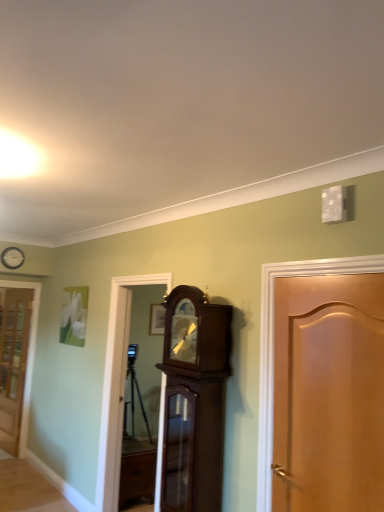
Locate an element on the screen. wooden door at right, the first door positioned from the front is located at coordinates (329, 394).

Measure the distance between point (137,481) and camera.

The depth of point (137,481) is 3.84 meters.

The height and width of the screenshot is (512, 384). What do you see at coordinates (13, 362) in the screenshot?
I see `translucent glass door at left, positioned as the 1th door in left-to-right order` at bounding box center [13, 362].

This screenshot has height=512, width=384. In order to click on white wooden clock at upper left in this screenshot , I will do `click(12, 258)`.

You are a GUI agent. You are given a task and a screenshot of the screen. Output one action in this format:
    pyautogui.click(x=<x>, y=<y>)
    Task: Click on the wooden door at right, the 1th door from the right
    
    Given the screenshot: What is the action you would take?
    pyautogui.click(x=329, y=394)

Considering the relative sizes of brown wooden cabinet at center, the 1th cabinetry from the left, and mahogany wood grandfather clock at center, which ranks as the second cabinetry in bottom-to-top order, in the image provided, is brown wooden cabinet at center, the 1th cabinetry from the left, bigger than mahogany wood grandfather clock at center, which ranks as the second cabinetry in bottom-to-top order,?

Actually, brown wooden cabinet at center, the 1th cabinetry from the left, might be smaller than mahogany wood grandfather clock at center, which ranks as the second cabinetry in bottom-to-top order.

Is the depth of brown wooden cabinet at center, the 1th cabinetry from the left, less than that of mahogany wood grandfather clock at center, which ranks as the second cabinetry in bottom-to-top order?

That is False.

Measure the distance from brown wooden cabinet at center, the 2th cabinetry when ordered from top to bottom, to mahogany wood grandfather clock at center, the first cabinetry from the front.

brown wooden cabinet at center, the 2th cabinetry when ordered from top to bottom, is 1.61 meters from mahogany wood grandfather clock at center, the first cabinetry from the front.

Is brown wooden cabinet at center, which ranks as the first cabinetry in back-to-front order, facing away from mahogany wood grandfather clock at center, the 2th cabinetry in the back-to-front sequence?

No, mahogany wood grandfather clock at center, the 2th cabinetry in the back-to-front sequence, is not at the back of brown wooden cabinet at center, which ranks as the first cabinetry in back-to-front order.

Could you tell me if brown wooden cabinet at center, acting as the 1th cabinetry starting from the bottom, is facing wooden door at right, the 1th door from the right?

No, brown wooden cabinet at center, acting as the 1th cabinetry starting from the bottom, is not turned towards wooden door at right, the 1th door from the right.

In the scene shown: Can you confirm if brown wooden cabinet at center, which ranks as the first cabinetry in back-to-front order, is positioned to the right of wooden door at right, which ranks as the second door in back-to-front order?

No.

From the image's perspective, is brown wooden cabinet at center, which ranks as the first cabinetry in back-to-front order, located above or below wooden door at right, the 2th door when ordered from left to right?

brown wooden cabinet at center, which ranks as the first cabinetry in back-to-front order, is below wooden door at right, the 2th door when ordered from left to right.

Can you tell me how much translucent glass door at left, which is the 2th door from front to back, and mahogany wood grandfather clock at center, the first cabinetry viewed from the right, differ in facing direction?

5.53 degrees.

Which object is positioned more to the left, translucent glass door at left, which is counted as the 1th door, starting from the back, or mahogany wood grandfather clock at center, the first cabinetry viewed from the right?

translucent glass door at left, which is counted as the 1th door, starting from the back.

In terms of height, does translucent glass door at left, which is the second door from right to left, look taller or shorter compared to mahogany wood grandfather clock at center, the first cabinetry viewed from the right?

Considering their sizes, translucent glass door at left, which is the second door from right to left, has more height than mahogany wood grandfather clock at center, the first cabinetry viewed from the right.

From the image's perspective, is translucent glass door at left, positioned as the 1th door in left-to-right order, positioned above or below mahogany wood grandfather clock at center, the first cabinetry viewed from the right?

Based on their image positions, translucent glass door at left, positioned as the 1th door in left-to-right order, is located beneath mahogany wood grandfather clock at center, the first cabinetry viewed from the right.

Does white wooden clock at upper left have a lesser width compared to wooden door at right, which ranks as the second door in back-to-front order?

Indeed, white wooden clock at upper left has a lesser width compared to wooden door at right, which ranks as the second door in back-to-front order.

Who is bigger, white wooden clock at upper left or wooden door at right, which ranks as the second door in back-to-front order?

With larger size is wooden door at right, which ranks as the second door in back-to-front order.

From the image's perspective, which one is positioned lower, white wooden clock at upper left or wooden door at right, the 2th door when ordered from left to right?

From the image's view, wooden door at right, the 2th door when ordered from left to right, is below.

This screenshot has height=512, width=384. I want to click on clock on the left side of wooden door at right, the 1th door from the right, so click(x=12, y=258).

Based on the photo, is wooden door at right, the first door positioned from the front, oriented away from mahogany wood grandfather clock at center, the 2th cabinetry viewed from the left?

No, wooden door at right, the first door positioned from the front, is not facing away from mahogany wood grandfather clock at center, the 2th cabinetry viewed from the left.

The image size is (384, 512). Identify the location of door located above the mahogany wood grandfather clock at center, the first cabinetry from the front (from a real-world perspective). coord(329,394).

Which is closer to the camera, (322, 313) or (172, 459)?

Point (322, 313) is closer to the camera than point (172, 459).

How much distance is there between wooden door at right, which ranks as the second door in back-to-front order, and mahogany wood grandfather clock at center, which ranks as the second cabinetry in bottom-to-top order?

wooden door at right, which ranks as the second door in back-to-front order, is 23.66 inches from mahogany wood grandfather clock at center, which ranks as the second cabinetry in bottom-to-top order.

Which is behind, point (13, 388) or point (371, 339)?

The point (13, 388) is more distant.

Can wooden door at right, the first door positioned from the front, be found inside translucent glass door at left, which is counted as the 1th door, starting from the back?

No, translucent glass door at left, which is counted as the 1th door, starting from the back, does not contain wooden door at right, the first door positioned from the front.

Is the surface of translucent glass door at left, positioned as the 1th door in left-to-right order, in direct contact with wooden door at right, the 1th door from the right?

translucent glass door at left, positioned as the 1th door in left-to-right order, and wooden door at right, the 1th door from the right, are not in contact.

Consider the image. From the image's perspective, which object appears higher, translucent glass door at left, positioned as the 1th door in left-to-right order, or wooden door at right, the 2th door when ordered from left to right?

From the image's view, wooden door at right, the 2th door when ordered from left to right, is above.

Is the position of wooden door at right, which ranks as the second door in back-to-front order, more distant than that of white wooden clock at upper left?

No, wooden door at right, which ranks as the second door in back-to-front order, is closer to the camera.

From a real-world perspective, who is located lower, wooden door at right, the first door positioned from the front, or white wooden clock at upper left?

wooden door at right, the first door positioned from the front, is physically lower.

Is wooden door at right, the first door positioned from the front, aimed at white wooden clock at upper left?

No, wooden door at right, the first door positioned from the front, is not oriented towards white wooden clock at upper left.

From the picture: Is wooden door at right, the 2th door when ordered from left to right, shorter than white wooden clock at upper left?

In fact, wooden door at right, the 2th door when ordered from left to right, may be taller than white wooden clock at upper left.

Where is `cabinetry in front of the brown wooden cabinet at center, acting as the 1th cabinetry starting from the bottom`? cabinetry in front of the brown wooden cabinet at center, acting as the 1th cabinetry starting from the bottom is located at coordinates (192, 443).

Where is `the 2nd cabinetry to the left when counting from the wooden door at right, the 1th door from the right`? the 2nd cabinetry to the left when counting from the wooden door at right, the 1th door from the right is located at coordinates (137, 470).

Estimate the real-world distances between objects in this image. Which object is further from mahogany wood grandfather clock at center, the 2th cabinetry in the back-to-front sequence, white wooden clock at upper left or translucent glass door at left, which is counted as the 1th door, starting from the back?

white wooden clock at upper left lies further to mahogany wood grandfather clock at center, the 2th cabinetry in the back-to-front sequence, than the other object.

Looking at this image, from the image, which object appears to be nearer to mahogany wood grandfather clock at center, the first cabinetry from the front, brown wooden cabinet at center, acting as the 1th cabinetry starting from the bottom, or white wooden clock at upper left?

brown wooden cabinet at center, acting as the 1th cabinetry starting from the bottom.

From the image, which object appears to be farther from mahogany wood grandfather clock at center, the 2th cabinetry in the back-to-front sequence, wooden door at right, the 2th door when ordered from left to right, or translucent glass door at left, positioned as the 1th door in left-to-right order?

translucent glass door at left, positioned as the 1th door in left-to-right order, is further to mahogany wood grandfather clock at center, the 2th cabinetry in the back-to-front sequence.

From the image, which object appears to be farther from brown wooden cabinet at center, placed as the second cabinetry when sorted from front to back, translucent glass door at left, positioned as the 1th door in left-to-right order, or wooden door at right, the 1th door from the right?

wooden door at right, the 1th door from the right, lies further to brown wooden cabinet at center, placed as the second cabinetry when sorted from front to back, than the other object.

Looking at the image, which one is located further to brown wooden cabinet at center, which appears as the 2th cabinetry when viewed from the right, translucent glass door at left, which is the 2th door from front to back, or mahogany wood grandfather clock at center, the first cabinetry viewed from the right?

translucent glass door at left, which is the 2th door from front to back, is further to brown wooden cabinet at center, which appears as the 2th cabinetry when viewed from the right.

Based on the photo, which object lies further to the anchor point white wooden clock at upper left, wooden door at right, which ranks as the second door in back-to-front order, or brown wooden cabinet at center, which ranks as the first cabinetry in back-to-front order?

Among the two, wooden door at right, which ranks as the second door in back-to-front order, is located further to white wooden clock at upper left.

When comparing their distances from brown wooden cabinet at center, the 1th cabinetry from the left, does mahogany wood grandfather clock at center, the 2th cabinetry in the back-to-front sequence, or wooden door at right, which ranks as the second door in back-to-front order, seem closer?

The object closer to brown wooden cabinet at center, the 1th cabinetry from the left, is mahogany wood grandfather clock at center, the 2th cabinetry in the back-to-front sequence.

Estimate the real-world distances between objects in this image. Which object is further from mahogany wood grandfather clock at center, the first cabinetry from the top, white wooden clock at upper left or brown wooden cabinet at center, the 2th cabinetry when ordered from top to bottom?

Among the two, white wooden clock at upper left is located further to mahogany wood grandfather clock at center, the first cabinetry from the top.

Locate an element on the screen. This screenshot has height=512, width=384. clock between mahogany wood grandfather clock at center, the first cabinetry from the front, and translucent glass door at left, positioned as the 1th door in left-to-right order, along the z-axis is located at coordinates (12, 258).

Locate an element on the screen. The width and height of the screenshot is (384, 512). cabinetry positioned between wooden door at right, the 1th door from the right, and brown wooden cabinet at center, which appears as the 2th cabinetry when viewed from the right, from near to far is located at coordinates (192, 443).

Identify the location of clock between wooden door at right, the 2th door when ordered from left to right, and translucent glass door at left, which is the second door from right to left, from front to back. The height and width of the screenshot is (512, 384). (12, 258).

You are a GUI agent. You are given a task and a screenshot of the screen. Output one action in this format:
    pyautogui.click(x=<x>, y=<y>)
    Task: Click on the cabinetry positioned between mahogany wood grandfather clock at center, which ranks as the second cabinetry in bottom-to-top order, and translucent glass door at left, which is counted as the 1th door, starting from the back, from near to far
    This screenshot has height=512, width=384.
    Given the screenshot: What is the action you would take?
    pyautogui.click(x=137, y=470)